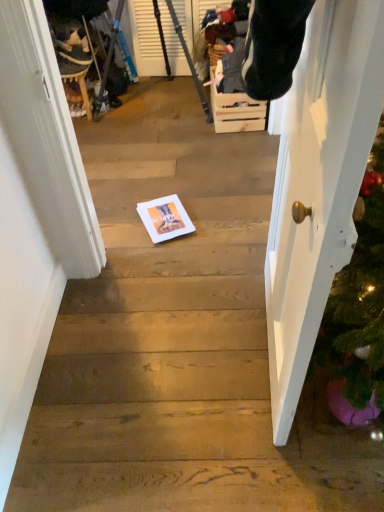
Identify the location of free region under white glossy door at right (from a real-world perspective). (264, 352).